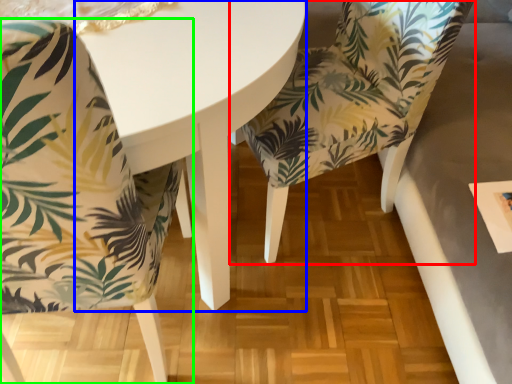
Question: Considering the real-world distances, which object is farthest from chair (highlighted by a red box)? round table (highlighted by a blue box) or chair (highlighted by a green box)?

Choices:
 (A) round table
 (B) chair

Answer: (B)